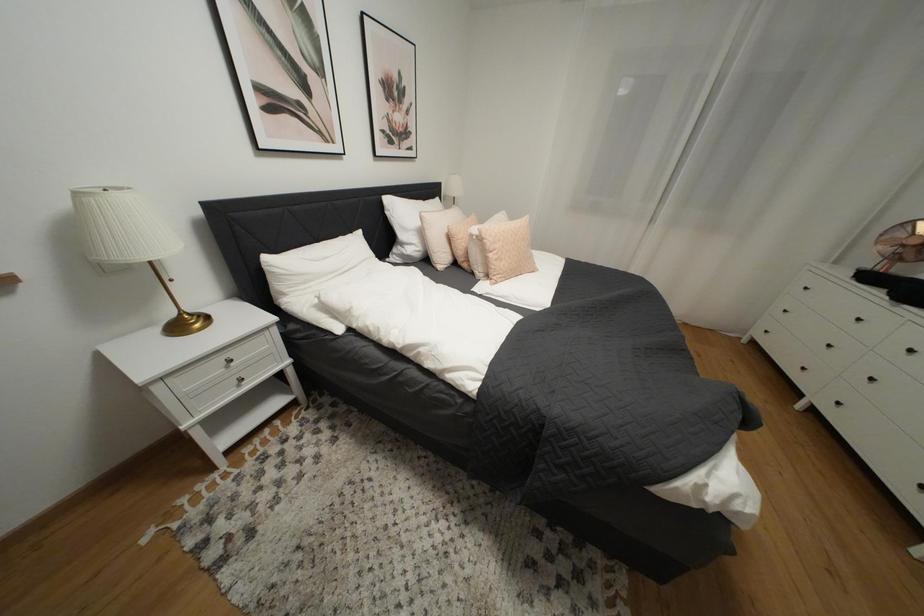
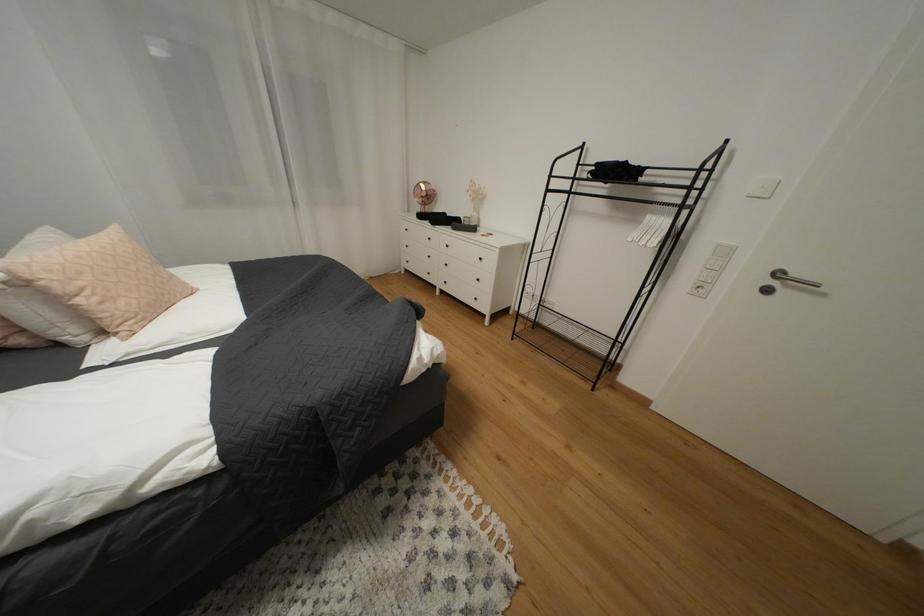
The images are taken continuously from a first-person perspective. In which direction is your viewpoint rotating?

The camera rotated toward right-down.